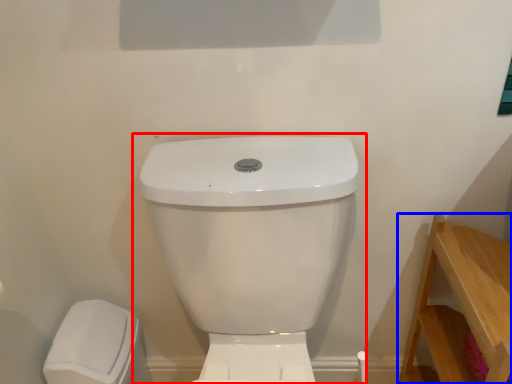
Question: Among these objects, which one is farthest to the camera, toilet (highlighted by a red box) or furniture (highlighted by a blue box)?

Choices:
 (A) toilet
 (B) furniture

Answer: (B)